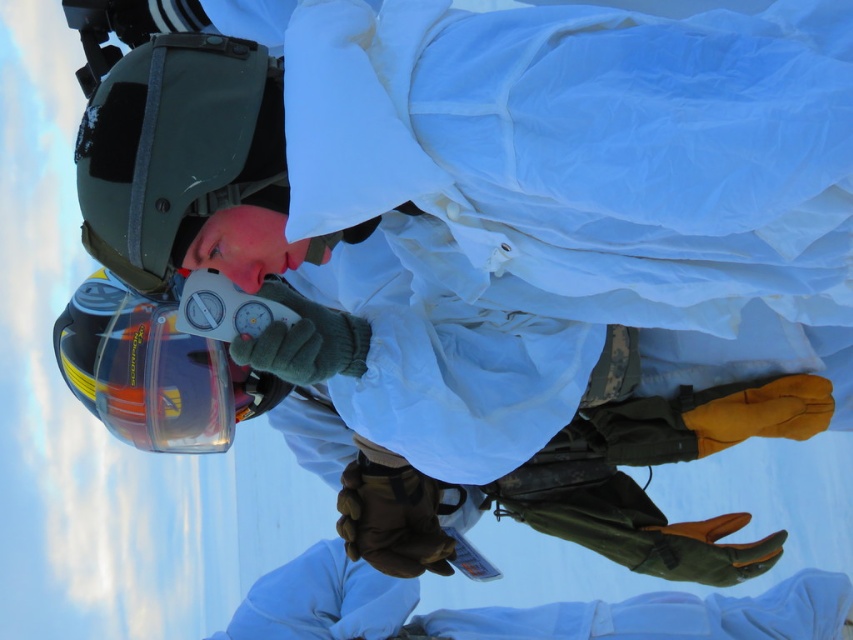
From the picture: You are planning to carry both the matte white snowboard at center and the translucent orange helmet at lower left through a narrow corridor. Which item should you carry first to ensure it fits through the entrance? Please explain your reasoning.

The matte white snowboard at center is wider than the translucent orange helmet at lower left. Therefore, you should carry the translucent orange helmet at lower left first to ensure it fits through the entrance before attempting the wider snowboard.

Based on the coordinates provided in the image, where is the glossy black helmet at upper left located?

The glossy black helmet at upper left is located at coordinates point [175,148].